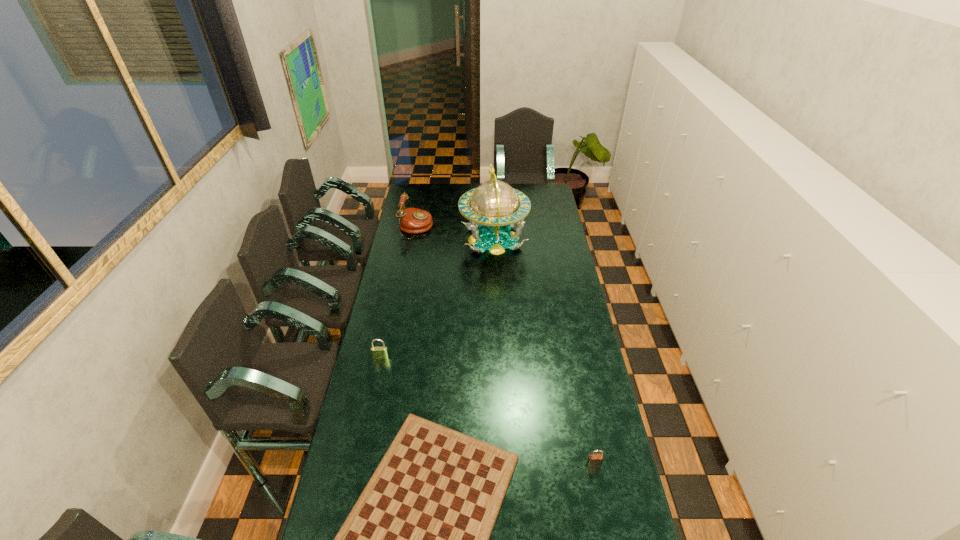
Locate an element on the screen. This screenshot has height=540, width=960. telephone present at the left edge is located at coordinates (411, 220).

This screenshot has height=540, width=960. I want to click on padlock that is at the left edge, so click(x=377, y=352).

Image resolution: width=960 pixels, height=540 pixels. What are the coordinates of `object located in the right edge section of the desktop` in the screenshot? It's located at (594, 460).

The width and height of the screenshot is (960, 540). Find the location of `vacant region at the far edge of the desktop`. vacant region at the far edge of the desktop is located at coordinates (437, 201).

The image size is (960, 540). In the image, there is a desktop. What are the coordinates of `vacant region at the left edge` in the screenshot? It's located at (345, 465).

Where is `vacant space at the right edge of the desktop`? The image size is (960, 540). vacant space at the right edge of the desktop is located at coordinates (564, 248).

At what (x,y) coordinates should I click in order to perform the action: click on empty space that is in between the telephone and the taller padlock. Please return your answer as a coordinate pair (x, y). Looking at the image, I should click on (398, 292).

Identify the location of vacant point located between the fourth shortest object and the right padlock. (505, 346).

I want to click on vacant space in between the tallest object and the right padlock, so click(543, 352).

Where is `vacant space in between the telephone and the tallest object`? Image resolution: width=960 pixels, height=540 pixels. vacant space in between the telephone and the tallest object is located at coordinates (455, 233).